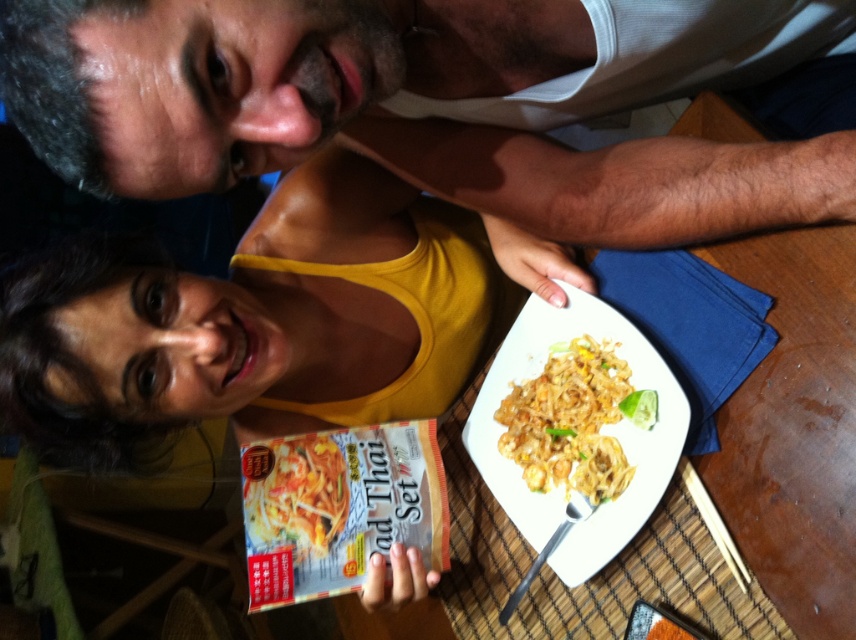
Question: Which point appears closest to the camera in this image?

Choices:
 (A) (593, 534)
 (B) (302, 454)
 (C) (424, 76)
 (D) (563, 353)

Answer: (C)

Question: Considering the real-world distances, which object is closest to the shiny white plate at center?

Choices:
 (A) yellowish matte noodles at center
 (B) white tank top at upper center
 (C) yellow matte pad thai set at center

Answer: (A)

Question: Is shiny white plate at center smaller than yellow matte pad thai set at center?

Choices:
 (A) yes
 (B) no

Answer: (B)

Question: Is shiny white plate at center wider than yellowish matte noodles at center?

Choices:
 (A) yes
 (B) no

Answer: (A)

Question: Which point is closer to the camera?

Choices:
 (A) (839, 166)
 (B) (557, 474)
 (C) (254, 508)

Answer: (A)

Question: Can you confirm if shiny white plate at center is positioned above yellowish matte noodles at center?

Choices:
 (A) no
 (B) yes

Answer: (A)